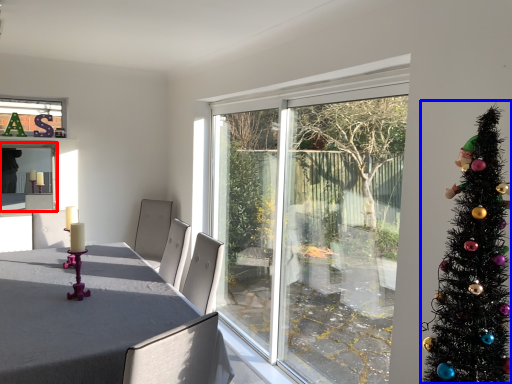
Question: Among these objects, which one is farthest to the camera, window screen (highlighted by a red box) or christmas tree (highlighted by a blue box)?

Choices:
 (A) window screen
 (B) christmas tree

Answer: (A)